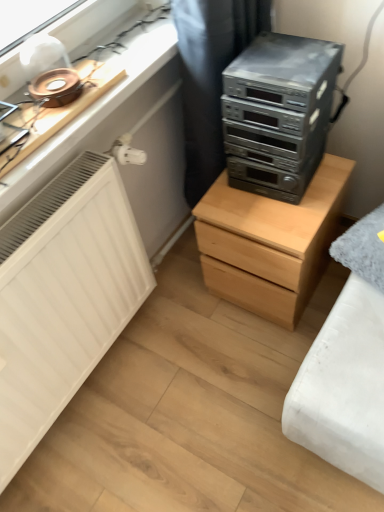
You are a GUI agent. You are given a task and a screenshot of the screen. Output one action in this format:
    pyautogui.click(x=<x>, y=<y>)
    Task: Click on the satin black stereo at upper right
    
    Given the screenshot: What is the action you would take?
    pyautogui.click(x=278, y=113)

This screenshot has height=512, width=384. Find the location of `black fabric curtain at upper center`. black fabric curtain at upper center is located at coordinates (210, 77).

This screenshot has width=384, height=512. I want to click on satin black stereo at upper right, so click(x=278, y=113).

From the image's perspective, between satin black stereo at upper right and black fabric curtain at upper center, who is located below?

satin black stereo at upper right appears lower in the image.

Based on the photo, can you see satin black stereo at upper right touching black fabric curtain at upper center?

They are not placed beside each other.

What's the angular difference between satin black stereo at upper right and black fabric curtain at upper center's facing directions?

The angle between the facing direction of satin black stereo at upper right and the facing direction of black fabric curtain at upper center is 84.5 degrees.

Who is smaller, satin black stereo at upper right or black fabric curtain at upper center?

satin black stereo at upper right.

From the picture: Is satin black stereo at upper right positioned far away from light wood chest of drawers at center?

satin black stereo at upper right is near light wood chest of drawers at center, not far away.

Is light wood chest of drawers at center at the back of satin black stereo at upper right?

No, light wood chest of drawers at center is not at the back of satin black stereo at upper right.

Which is more to the left, satin black stereo at upper right or light wood chest of drawers at center?

From the viewer's perspective, satin black stereo at upper right appears more on the left side.

From the image's perspective, which is above, satin black stereo at upper right or light wood chest of drawers at center?

satin black stereo at upper right.

Is light wood chest of drawers at center further to the viewer compared to satin black stereo at upper right?

Yes.

Can you confirm if light wood chest of drawers at center is wider than satin black stereo at upper right?

Yes, light wood chest of drawers at center is wider than satin black stereo at upper right.

How different are the orientations of light wood chest of drawers at center and satin black stereo at upper right in degrees?

light wood chest of drawers at center and satin black stereo at upper right are facing 2.05 degrees away from each other.

From the picture: Is light wood chest of drawers at center shorter than satin black stereo at upper right?

No.

Considering their positions, is black fabric curtain at upper center located in front of or behind satin black stereo at upper right?

Clearly, black fabric curtain at upper center is behind satin black stereo at upper right.

Considering the positions of point (210, 128) and point (298, 134), is point (210, 128) closer or farther from the camera than point (298, 134)?

Point (210, 128) is positioned farther from the camera compared to point (298, 134).

Is black fabric curtain at upper center smaller than satin black stereo at upper right?

Actually, black fabric curtain at upper center might be larger than satin black stereo at upper right.

Is black fabric curtain at upper center next to light wood chest of drawers at center?

They are not placed beside each other.

In the image, is black fabric curtain at upper center on the left side or the right side of light wood chest of drawers at center?

black fabric curtain at upper center is positioned on light wood chest of drawers at center's left side.

The height and width of the screenshot is (512, 384). I want to click on chest of drawers below the black fabric curtain at upper center (from a real-world perspective), so click(269, 242).

Can you confirm if light wood chest of drawers at center is thinner than black fabric curtain at upper center?

No, light wood chest of drawers at center is not thinner than black fabric curtain at upper center.

Is light wood chest of drawers at center not near black fabric curtain at upper center?

That's not correct — light wood chest of drawers at center is a little close to black fabric curtain at upper center.

From the image's perspective, between light wood chest of drawers at center and black fabric curtain at upper center, who is located below?

light wood chest of drawers at center appears lower in the image.

Find the location of a particular element. This screenshot has width=384, height=512. the chest of drawers located below the black fabric curtain at upper center (from the image's perspective) is located at coordinates pos(269,242).

Where is `curtain located above the satin black stereo at upper right (from the image's perspective)`? curtain located above the satin black stereo at upper right (from the image's perspective) is located at coordinates (210, 77).

At what (x,y) coordinates should I click in order to perform the action: click on chest of drawers below the satin black stereo at upper right (from a real-world perspective). Please return your answer as a coordinate pair (x, y). Looking at the image, I should click on (269, 242).

When comparing their distances from light wood chest of drawers at center, does satin black stereo at upper right or black fabric curtain at upper center seem further?

black fabric curtain at upper center is positioned further to the anchor light wood chest of drawers at center.

Based on their spatial positions, is light wood chest of drawers at center or black fabric curtain at upper center closer to satin black stereo at upper right?

black fabric curtain at upper center.

Based on their spatial positions, is satin black stereo at upper right or light wood chest of drawers at center closer to black fabric curtain at upper center?

The object closer to black fabric curtain at upper center is satin black stereo at upper right.

From the image, which object appears to be farther from satin black stereo at upper right, black fabric curtain at upper center or light wood chest of drawers at center?

Among the two, light wood chest of drawers at center is located further to satin black stereo at upper right.

Considering their positions, is light wood chest of drawers at center positioned closer to black fabric curtain at upper center than satin black stereo at upper right?

satin black stereo at upper right lies closer to black fabric curtain at upper center than the other object.

From the image, which object appears to be farther from light wood chest of drawers at center, black fabric curtain at upper center or satin black stereo at upper right?

black fabric curtain at upper center is further to light wood chest of drawers at center.

Where is `home appliance between black fabric curtain at upper center and light wood chest of drawers at center from top to bottom`? The width and height of the screenshot is (384, 512). home appliance between black fabric curtain at upper center and light wood chest of drawers at center from top to bottom is located at coordinates (278, 113).